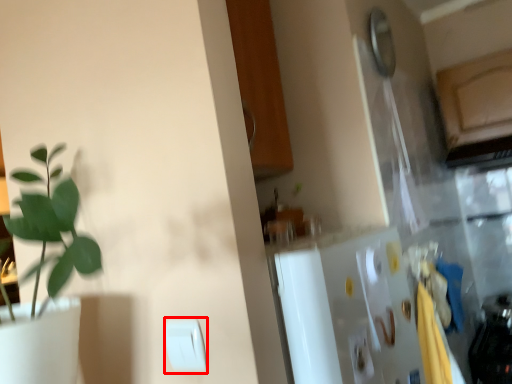
Question: From the image, what is the correct spatial relationship of light switch (annotated by the red box) in relation to light switch?

Choices:
 (A) left
 (B) right

Answer: (A)